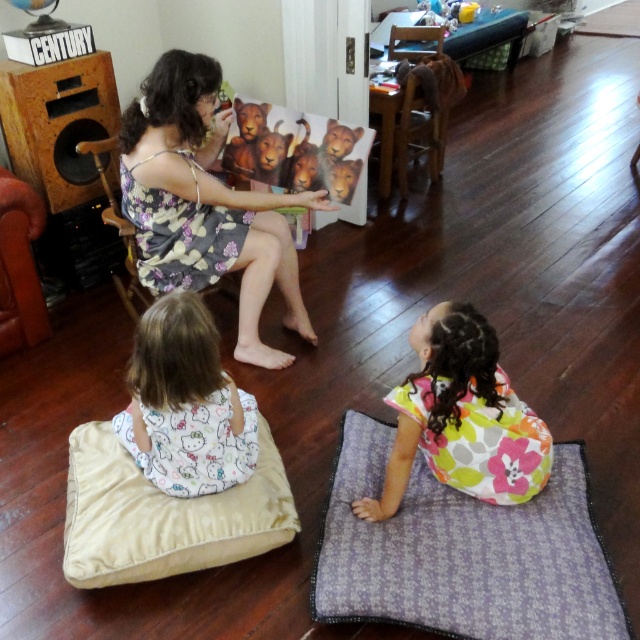
In the storytelling scene, there are two dresses present. The floral dress at upper center and the white cotton dress at lower left. Which of these two dresses is positioned to the right side of the other?

The floral dress at upper center is positioned to the right of the white cotton dress at lower left.

You are a tailor measuring fabrics for a project. You have a purple fabric mat at lower right and a white cotton dress at lower left. Which fabric piece is shorter in length?

The purple fabric mat at lower right is shorter than the white cotton dress at lower left.